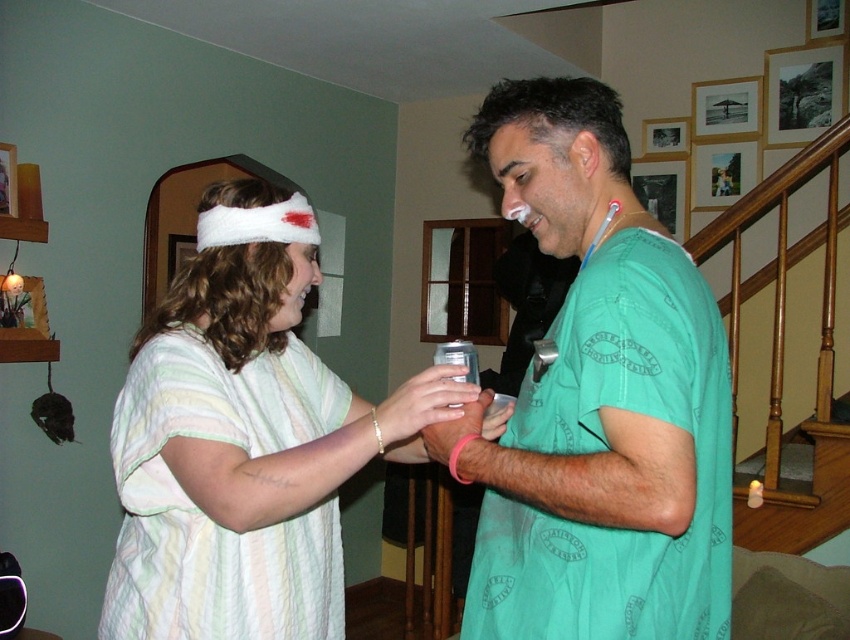
Question: Among these points, which one is farthest from the camera?

Choices:
 (A) (315, 282)
 (B) (528, 186)

Answer: (A)

Question: Which point is farther from the camera taking this photo?

Choices:
 (A) (231, 266)
 (B) (653, 266)

Answer: (A)

Question: Among these points, which one is nearest to the camera?

Choices:
 (A) (514, 593)
 (B) (332, 516)

Answer: (A)

Question: Does green fabric shirt at center have a greater width compared to white fluffy headband at upper left?

Choices:
 (A) no
 (B) yes

Answer: (A)

Question: Is green fabric shirt at center wider than white fluffy headband at upper left?

Choices:
 (A) yes
 (B) no

Answer: (B)

Question: Is green fabric shirt at center thinner than white fluffy headband at upper left?

Choices:
 (A) no
 (B) yes

Answer: (B)